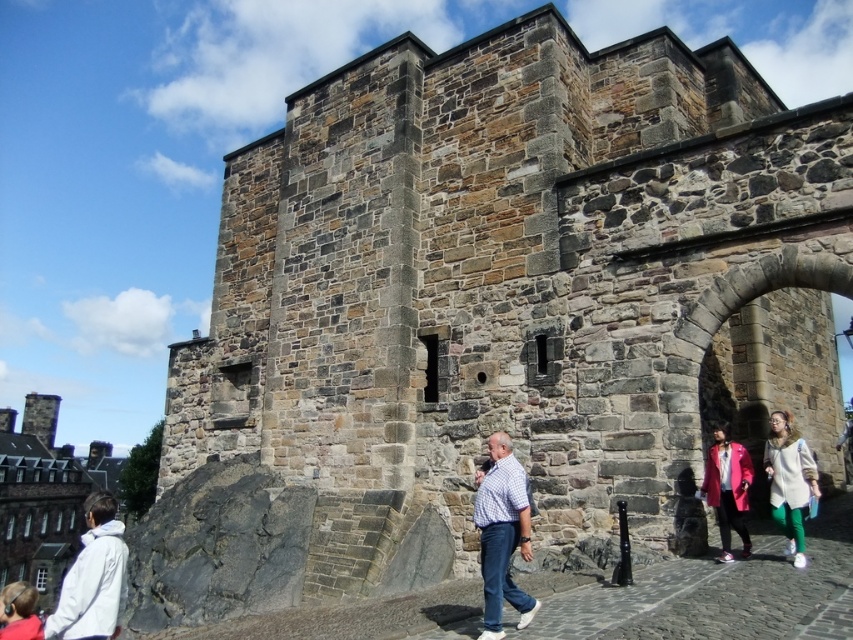
Locate an element on the screen. stone archway at center right is located at coordinates (738, 308).

Between stone archway at center right and pink matte coat at lower right, which one appears on the right side from the viewer's perspective?

From the viewer's perspective, stone archway at center right appears more on the right side.

The image size is (853, 640). I want to click on stone archway at center right, so click(x=738, y=308).

You are a GUI agent. You are given a task and a screenshot of the screen. Output one action in this format:
    pyautogui.click(x=<x>, y=<y>)
    Task: Click on the stone archway at center right
    
    Given the screenshot: What is the action you would take?
    pyautogui.click(x=738, y=308)

Can you confirm if white matte jacket at lower left is bigger than white fuzzy coat at lower right?

Yes, white matte jacket at lower left is bigger than white fuzzy coat at lower right.

Which is above, white matte jacket at lower left or white fuzzy coat at lower right?

Positioned higher is white fuzzy coat at lower right.

Locate an element on the screen. The height and width of the screenshot is (640, 853). white matte jacket at lower left is located at coordinates (93, 579).

Which is above, checkered fabric shirt at center or white matte jacket at lower left?

checkered fabric shirt at center is higher up.

Which is behind, point (503, 592) or point (65, 621)?

Positioned behind is point (503, 592).

Between point (495, 474) and point (103, 502), which one is positioned in front?

Point (495, 474) is in front.

Identify the location of checkered fabric shirt at center. The image size is (853, 640). (x=502, y=532).